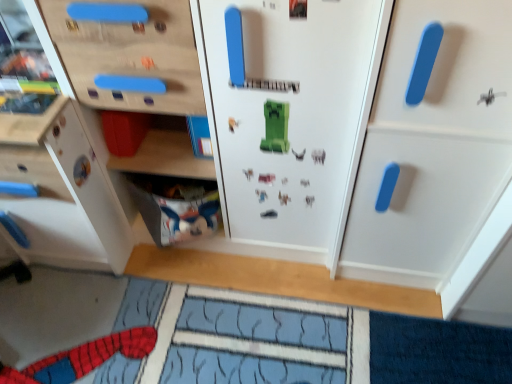
In order to face white fabric at lower left, should I rotate leftwards or rightwards?

You should rotate left by 10.354 degrees.

What are the coordinates of `white matte cabinet at left, the second cabinetry viewed from the right` in the screenshot? It's located at (62, 194).

Image resolution: width=512 pixels, height=384 pixels. Find the location of `white fabric at lower left`. white fabric at lower left is located at coordinates (176, 207).

In terms of height, does white fabric at lower left look taller or shorter compared to white matte cabinet at left, the second cabinetry viewed from the right?

white fabric at lower left is shorter than white matte cabinet at left, the second cabinetry viewed from the right.

From the image's perspective, is white fabric at lower left below white matte cabinet at left, the second cabinetry viewed from the right?

Correct, white fabric at lower left appears lower than white matte cabinet at left, the second cabinetry viewed from the right, in the image.

Is white fabric at lower left smaller than white matte cabinet at left, positioned as the first cabinetry in left-to-right order?

Indeed, white fabric at lower left has a smaller size compared to white matte cabinet at left, positioned as the first cabinetry in left-to-right order.

Based on the photo, from a real-world perspective, between white fabric at lower left and white matte cabinet at right, arranged as the second cabinetry when viewed from the left, who is vertically lower?

white fabric at lower left.

Looking at this image, what's the angular difference between white fabric at lower left and white matte cabinet at right, which is the first cabinetry from right to left,'s facing directions?

There is a 1.71-degree angle between the facing directions of white fabric at lower left and white matte cabinet at right, which is the first cabinetry from right to left.

Where is `drawer located underneath the white matte cabinet at right, arranged as the second cabinetry when viewed from the left (from a real-world perspective)`? drawer located underneath the white matte cabinet at right, arranged as the second cabinetry when viewed from the left (from a real-world perspective) is located at coordinates (176, 207).

Between white fabric at lower left and white matte cabinet at right, arranged as the second cabinetry when viewed from the left, which one is positioned in front?

white matte cabinet at right, arranged as the second cabinetry when viewed from the left.

From a real-world perspective, which object stands above the other?

In real-world perspective, white matte cabinet at right, which is the first cabinetry from right to left, is above.

Considering the relative sizes of white matte cabinet at left, the second cabinetry viewed from the right, and white matte cabinet at right, arranged as the second cabinetry when viewed from the left, in the image provided, is white matte cabinet at left, the second cabinetry viewed from the right, thinner than white matte cabinet at right, arranged as the second cabinetry when viewed from the left,?

No, white matte cabinet at left, the second cabinetry viewed from the right, is not thinner than white matte cabinet at right, arranged as the second cabinetry when viewed from the left.

Can you confirm if white matte cabinet at left, positioned as the first cabinetry in left-to-right order, is positioned to the right of white matte cabinet at right, arranged as the second cabinetry when viewed from the left?

No, white matte cabinet at left, positioned as the first cabinetry in left-to-right order, is not to the right of white matte cabinet at right, arranged as the second cabinetry when viewed from the left.

In the scene shown: Between white matte cabinet at left, the second cabinetry viewed from the right, and white matte cabinet at right, which is the first cabinetry from right to left, which one has less height?

white matte cabinet at left, the second cabinetry viewed from the right.

Considering the sizes of white matte cabinet at right, arranged as the second cabinetry when viewed from the left, and white fabric at lower left in the image, is white matte cabinet at right, arranged as the second cabinetry when viewed from the left, taller or shorter than white fabric at lower left?

Clearly, white matte cabinet at right, arranged as the second cabinetry when viewed from the left, is taller compared to white fabric at lower left.

Is white matte cabinet at right, which is the first cabinetry from right to left, not inside white fabric at lower left?

Indeed, white matte cabinet at right, which is the first cabinetry from right to left, is completely outside white fabric at lower left.

From the image's perspective, would you say white matte cabinet at right, which is the first cabinetry from right to left, is shown under white fabric at lower left?

Incorrect, from the image's perspective, white matte cabinet at right, which is the first cabinetry from right to left, is higher than white fabric at lower left.

Is white matte cabinet at right, which is the first cabinetry from right to left, looking in the opposite direction of white fabric at lower left?

No, white fabric at lower left is not at the back of white matte cabinet at right, which is the first cabinetry from right to left.

Would you say white matte cabinet at right, arranged as the second cabinetry when viewed from the left, contains white matte cabinet at left, positioned as the first cabinetry in left-to-right order?

No, white matte cabinet at left, positioned as the first cabinetry in left-to-right order, is located outside of white matte cabinet at right, arranged as the second cabinetry when viewed from the left.

Based on their positions, is white matte cabinet at right, arranged as the second cabinetry when viewed from the left, located to the left or right of white matte cabinet at left, positioned as the first cabinetry in left-to-right order?

white matte cabinet at right, arranged as the second cabinetry when viewed from the left, is positioned on white matte cabinet at left, positioned as the first cabinetry in left-to-right order,'s right side.

From a real-world perspective, who is located lower, white matte cabinet at right, which is the first cabinetry from right to left, or white matte cabinet at left, positioned as the first cabinetry in left-to-right order?

white matte cabinet at left, positioned as the first cabinetry in left-to-right order, from a real-world perspective.

Is white matte cabinet at right, arranged as the second cabinetry when viewed from the left, taller than white matte cabinet at left, the second cabinetry viewed from the right?

Yes, white matte cabinet at right, arranged as the second cabinetry when viewed from the left, is taller than white matte cabinet at left, the second cabinetry viewed from the right.

What's the angular difference between white matte cabinet at left, the second cabinetry viewed from the right, and white fabric at lower left's facing directions?

0.0123 degrees separate the facing orientations of white matte cabinet at left, the second cabinetry viewed from the right, and white fabric at lower left.

Is white matte cabinet at left, positioned as the first cabinetry in left-to-right order, oriented away from white fabric at lower left?

No, white matte cabinet at left, positioned as the first cabinetry in left-to-right order,'s orientation is not away from white fabric at lower left.

From the image's perspective, is white matte cabinet at left, the second cabinetry viewed from the right, located above or below white fabric at lower left?

white matte cabinet at left, the second cabinetry viewed from the right, is above white fabric at lower left.

Does white matte cabinet at left, the second cabinetry viewed from the right, touch white fabric at lower left?

white matte cabinet at left, the second cabinetry viewed from the right, and white fabric at lower left are not in contact.

Where is `drawer lying on the right of white matte cabinet at left, positioned as the first cabinetry in left-to-right order`? The height and width of the screenshot is (384, 512). drawer lying on the right of white matte cabinet at left, positioned as the first cabinetry in left-to-right order is located at coordinates (176, 207).

Identify the location of the 2nd cabinetry above the white fabric at lower left (from a real-world perspective). (433, 146).

Looking at the image, which one is located further to white matte cabinet at right, arranged as the second cabinetry when viewed from the left, white fabric at lower left or white matte cabinet at left, the second cabinetry viewed from the right?

white matte cabinet at left, the second cabinetry viewed from the right.

Looking at the image, which one is located closer to white matte cabinet at left, positioned as the first cabinetry in left-to-right order, white matte cabinet at right, which is the first cabinetry from right to left, or white fabric at lower left?

Among the two, white fabric at lower left is located nearer to white matte cabinet at left, positioned as the first cabinetry in left-to-right order.

Considering their positions, is white fabric at lower left positioned closer to white matte cabinet at left, positioned as the first cabinetry in left-to-right order, than white matte cabinet at right, which is the first cabinetry from right to left?

Among the two, white fabric at lower left is located nearer to white matte cabinet at left, positioned as the first cabinetry in left-to-right order.

Which object lies nearer to the anchor point white fabric at lower left, white matte cabinet at right, which is the first cabinetry from right to left, or white matte cabinet at left, the second cabinetry viewed from the right?

white matte cabinet at left, the second cabinetry viewed from the right, is closer to white fabric at lower left.

Which object lies further to the anchor point white matte cabinet at right, which is the first cabinetry from right to left, white matte cabinet at left, positioned as the first cabinetry in left-to-right order, or white fabric at lower left?

white matte cabinet at left, positioned as the first cabinetry in left-to-right order, is further to white matte cabinet at right, which is the first cabinetry from right to left.

Which object lies nearer to the anchor point white fabric at lower left, white matte cabinet at left, positioned as the first cabinetry in left-to-right order, or white matte cabinet at right, arranged as the second cabinetry when viewed from the left?

The object closer to white fabric at lower left is white matte cabinet at left, positioned as the first cabinetry in left-to-right order.

This screenshot has height=384, width=512. I want to click on drawer between white matte cabinet at left, positioned as the first cabinetry in left-to-right order, and white matte cabinet at right, arranged as the second cabinetry when viewed from the left, so click(x=176, y=207).